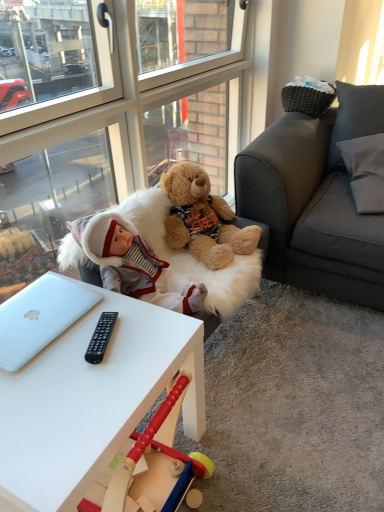
Question: Is silver metallic laptop at lower left at the right side of white fabric pillow at upper right?

Choices:
 (A) no
 (B) yes

Answer: (A)

Question: Is silver metallic laptop at lower left shorter than white fabric pillow at upper right?

Choices:
 (A) yes
 (B) no

Answer: (A)

Question: Is silver metallic laptop at lower left at the left side of white fabric pillow at upper right?

Choices:
 (A) yes
 (B) no

Answer: (A)

Question: Is silver metallic laptop at lower left turned away from white fabric pillow at upper right?

Choices:
 (A) yes
 (B) no

Answer: (B)

Question: Is silver metallic laptop at lower left far away from white fabric pillow at upper right?

Choices:
 (A) no
 (B) yes

Answer: (B)

Question: Is point (354, 178) closer or farther from the camera than point (142, 232)?

Choices:
 (A) closer
 (B) farther

Answer: (B)

Question: From their relative heights in the image, would you say white fabric pillow at upper right is taller or shorter than white fur swivel chair at center?

Choices:
 (A) tall
 (B) short

Answer: (B)

Question: From the image's perspective, is white fabric pillow at upper right positioned above or below white fur swivel chair at center?

Choices:
 (A) above
 (B) below

Answer: (A)

Question: From a real-world perspective, is white fabric pillow at upper right positioned above or below white fur swivel chair at center?

Choices:
 (A) below
 (B) above

Answer: (B)

Question: Considering the positions of white matte desk at center and transparent glass door at upper left in the image, is white matte desk at center bigger or smaller than transparent glass door at upper left?

Choices:
 (A) small
 (B) big

Answer: (A)

Question: Does point (148, 345) appear closer or farther from the camera than point (188, 122)?

Choices:
 (A) farther
 (B) closer

Answer: (B)

Question: Considering the positions of white matte desk at center and transparent glass door at upper left in the image, is white matte desk at center wider or thinner than transparent glass door at upper left?

Choices:
 (A) wide
 (B) thin

Answer: (A)

Question: From a real-world perspective, relative to transparent glass door at upper left, is white matte desk at center vertically above or below?

Choices:
 (A) below
 (B) above

Answer: (A)

Question: Would you say transparent glass door at upper left is inside or outside fluffy brown teddy bear at center?

Choices:
 (A) inside
 (B) outside

Answer: (B)

Question: Is transparent glass door at upper left taller or shorter than fluffy brown teddy bear at center?

Choices:
 (A) tall
 (B) short

Answer: (A)